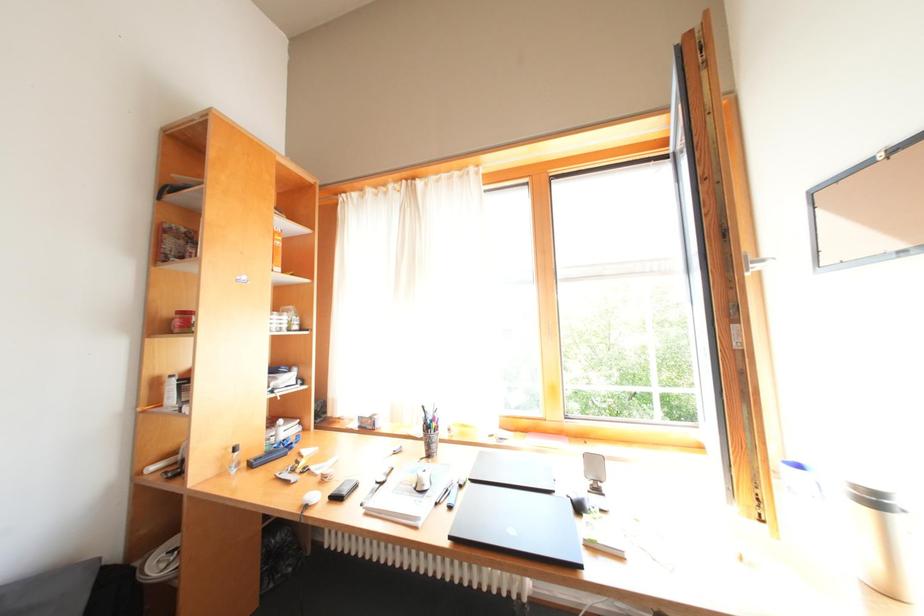
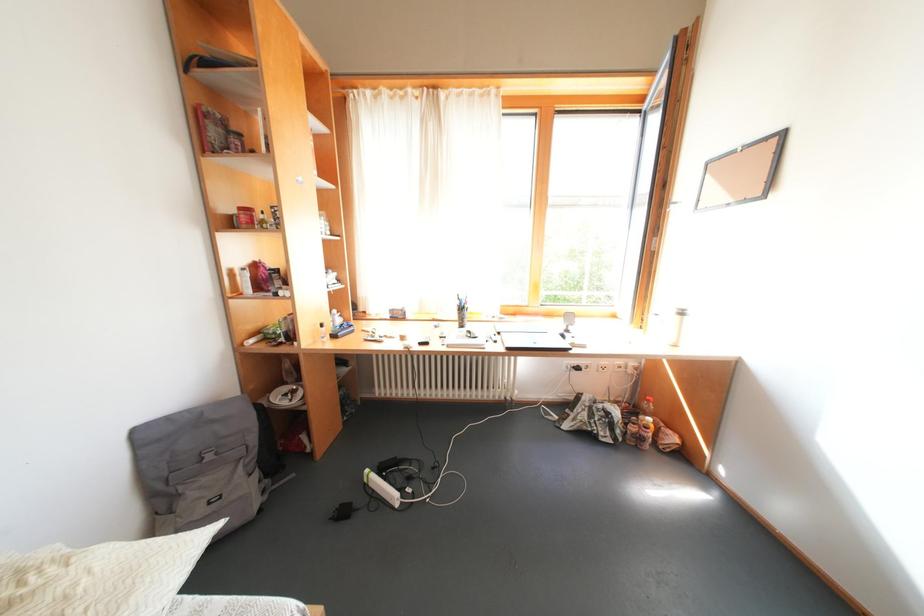
The first image is from the beginning of the video and the second image is from the end. How did the camera likely rotate when shooting the video?

The camera rotated toward right-down.